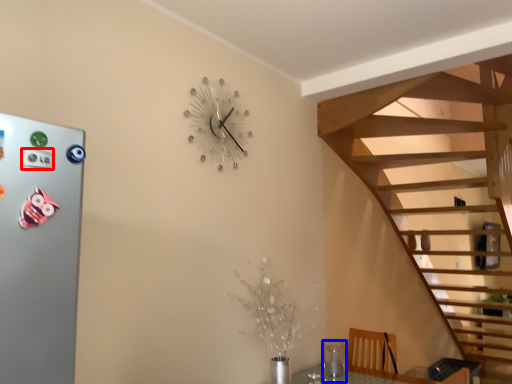
Question: Which point is further to the camera, button (highlighted by a red box) or glass vase (highlighted by a blue box)?

Choices:
 (A) button
 (B) glass vase

Answer: (B)